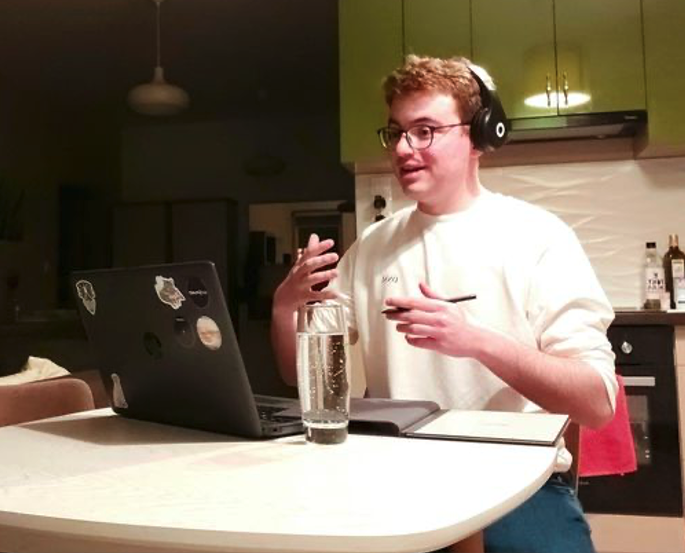
At what (x,y) coordinates should I click in order to perform the action: click on laptop. Please return your answer as a coordinate pair (x, y). Looking at the image, I should click on (238, 389).